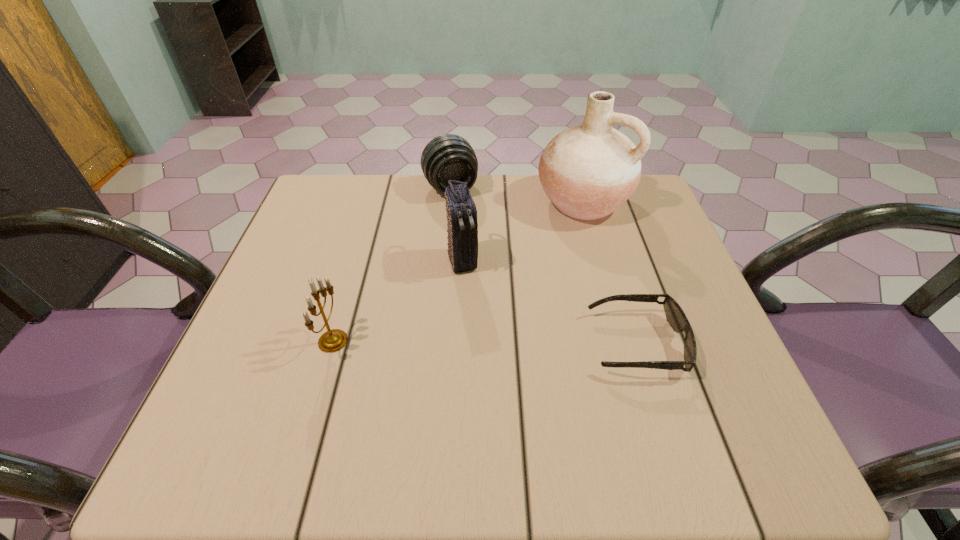
Where is `free point between the tallest object and the fourth tallest object`? free point between the tallest object and the fourth tallest object is located at coordinates (516, 195).

This screenshot has height=540, width=960. I want to click on unoccupied area between the telephoto lens and the sunglasses, so click(543, 266).

Identify the location of empty location between the third farthest object and the tallest object. (523, 231).

Identify the location of free spot between the candelabrum and the fourth tallest object. [x=392, y=265].

Identify the location of vacant region between the candelabrum and the sunglasses. (485, 342).

Identify the location of free area in between the sunglasses and the clutch bag. (549, 302).

At what (x,y) coordinates should I click in order to perform the action: click on free area in between the pottery and the sunglasses. Please return your answer as a coordinate pair (x, y). Looking at the image, I should click on (610, 272).

The width and height of the screenshot is (960, 540). In order to click on free space between the sunglasses and the tallest object in this screenshot , I will do `click(610, 272)`.

Where is `object that stands as the third closest to the sunglasses`? This screenshot has height=540, width=960. object that stands as the third closest to the sunglasses is located at coordinates (447, 157).

The width and height of the screenshot is (960, 540). I want to click on object that is the second closest to the clutch bag, so click(x=588, y=171).